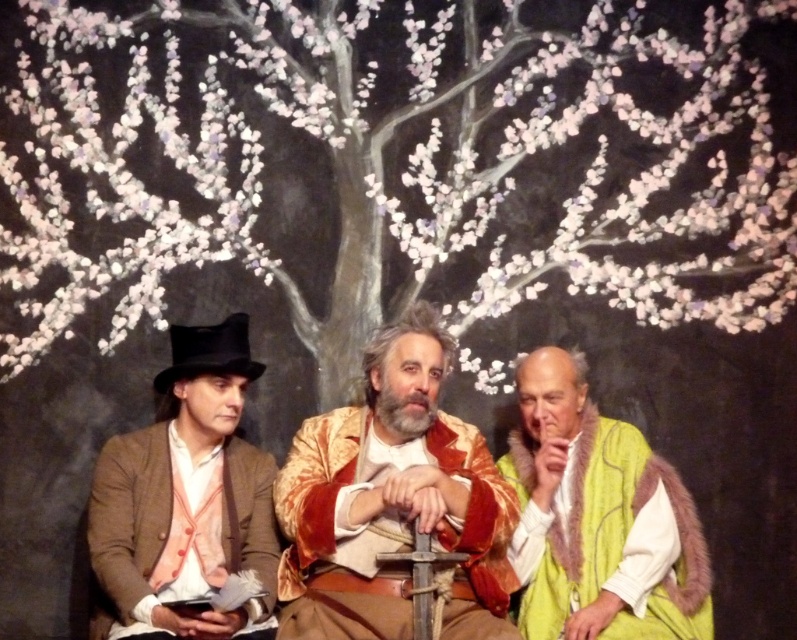
Question: Which object is farther from the camera taking this photo?

Choices:
 (A) matte brown coat at left
 (B) white textured tree at center
 (C) green fur vest at right
 (D) velvet gold jacket at center

Answer: (B)

Question: Does matte brown coat at left appear under green fur vest at right?

Choices:
 (A) no
 (B) yes

Answer: (A)

Question: Which of the following is the farthest from the observer?

Choices:
 (A) (597, 481)
 (B) (238, 64)
 (C) (442, 339)

Answer: (B)

Question: Can you confirm if white textured tree at center is smaller than green fur vest at right?

Choices:
 (A) yes
 (B) no

Answer: (B)

Question: Which of the following is the closest to the observer?

Choices:
 (A) white textured tree at center
 (B) matte brown coat at left
 (C) velvet gold jacket at center

Answer: (B)

Question: Is velvet gold jacket at center to the left of matte brown coat at left from the viewer's perspective?

Choices:
 (A) yes
 (B) no

Answer: (B)